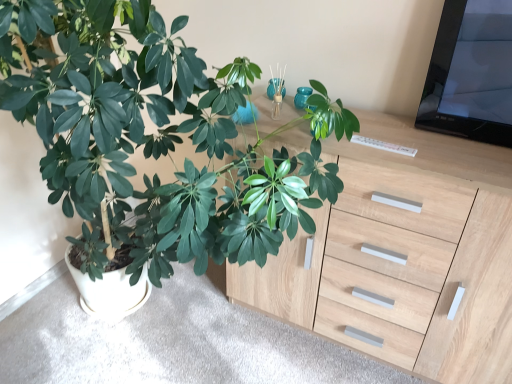
Question: Does point (444, 374) appear closer or farther from the camera than point (228, 82)?

Choices:
 (A) closer
 (B) farther

Answer: (B)

Question: Which is correct: light wood chest of drawers at center is inside green matte plant at left, or outside of it?

Choices:
 (A) inside
 (B) outside

Answer: (B)

Question: Estimate the real-world distances between objects in this image. Which object is closer to the light wood chest of drawers at center?

Choices:
 (A) green matte plant at left
 (B) matte wood cabinet at lower center

Answer: (A)

Question: Considering the real-world distances, which object is farthest from the light wood chest of drawers at center?

Choices:
 (A) green matte plant at left
 (B) matte wood cabinet at lower center

Answer: (B)